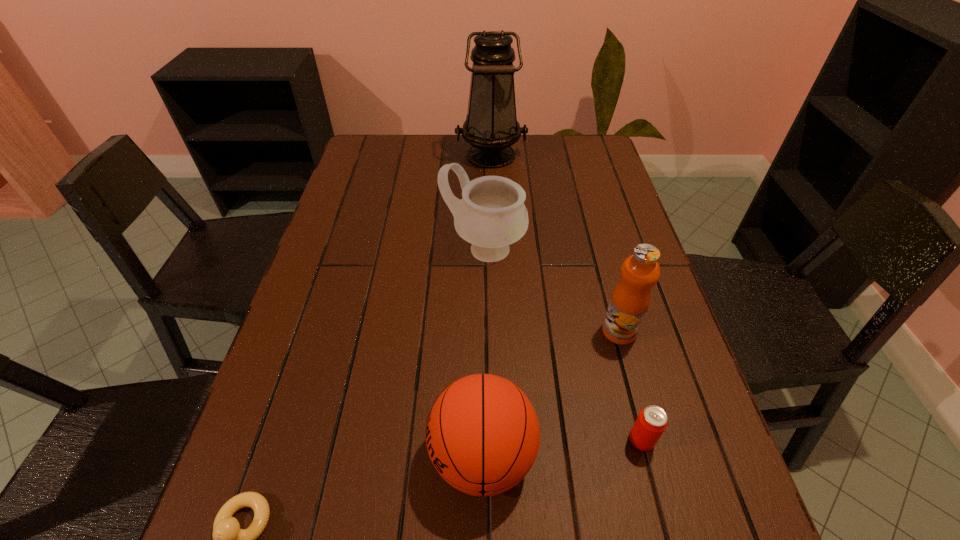
You are a GUI agent. You are given a task and a screenshot of the screen. Output one action in this format:
    pyautogui.click(x=<x>, y=<y>)
    Task: Click on the vacant point located between the second farthest object and the basketball
    This screenshot has width=960, height=540.
    Given the screenshot: What is the action you would take?
    pyautogui.click(x=483, y=353)

I want to click on free space between the third farthest object and the pottery, so click(x=551, y=291).

Identify the location of free space between the basketball and the tallest object. The height and width of the screenshot is (540, 960). (487, 306).

Identify the location of vacant area that lies between the fourth tallest object and the pottery. (483, 353).

Where is `vacant space in between the oil lamp and the third shortest object`? Image resolution: width=960 pixels, height=540 pixels. vacant space in between the oil lamp and the third shortest object is located at coordinates (487, 306).

This screenshot has width=960, height=540. What are the coordinates of `object that stands as the closest to the beer can` in the screenshot? It's located at (482, 434).

Select which object appears as the second closest to the fifth nearest object. Please provide its 2D coordinates. Your answer should be formatted as a tuple, i.e. [(x, y)], where the tuple contains the x and y coordinates of a point satisfying the conditions above.

[(491, 127)]